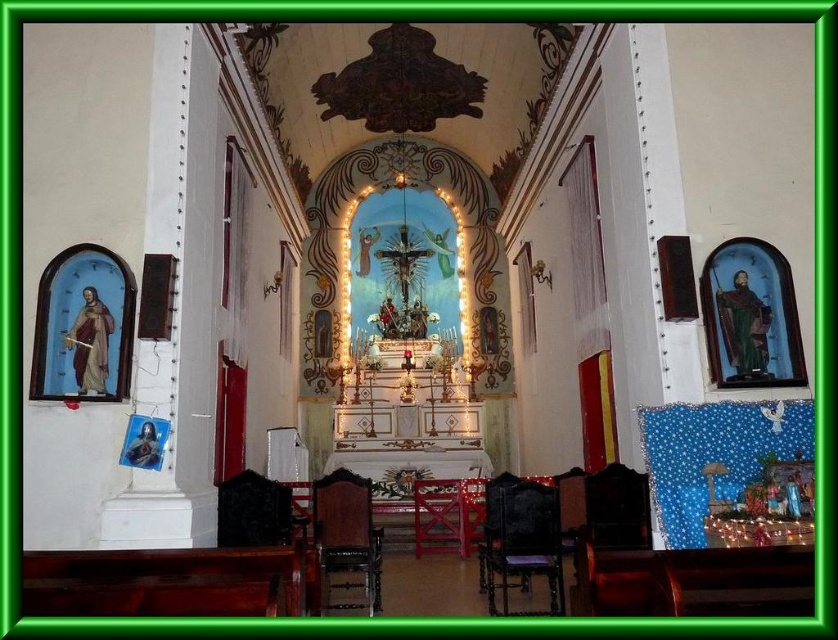
Looking at this image, you are a visitor entering the church and want to sit down. You see the dark brown polished wood church bench at lower left and the black leather chair at lower center. Which seating option is closer to the entrance?

The dark brown polished wood church bench at lower left is positioned over the black leather chair at lower center, meaning it is closer to the entrance. Therefore, the dark brown polished wood church bench at lower left is closer.

You are standing at the entrance of the church and want to sit down. There is a dark wood chair at lower right. Based on its 2D coordinates, can you estimate its position relative to the altar?

The dark wood chair at lower right is located at coordinates 0.847 on the x axis and 0.622 on the y axis, which places it to the right and slightly behind the altar area.